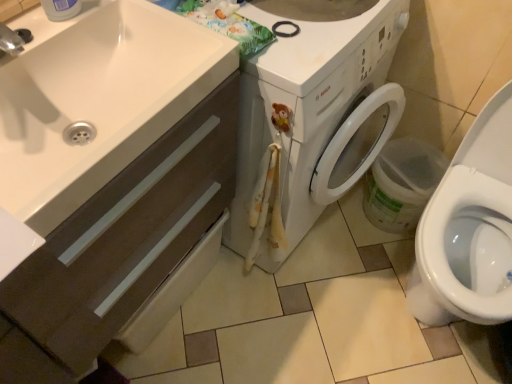
Locate an element on the screen. matte brown cabinet at lower left is located at coordinates 127,236.

What do you see at coordinates (127, 236) in the screenshot? The width and height of the screenshot is (512, 384). I see `matte brown cabinet at lower left` at bounding box center [127, 236].

Locate an element on the screen. The width and height of the screenshot is (512, 384). white glossy toilet at lower right is located at coordinates (469, 228).

Describe the element at coordinates (469, 228) in the screenshot. I see `white glossy toilet at lower right` at that location.

What do you see at coordinates (316, 104) in the screenshot?
I see `white glossy washing machine at center` at bounding box center [316, 104].

Locate an element on the screen. The width and height of the screenshot is (512, 384). matte brown cabinet at lower left is located at coordinates (127, 236).

Is white glossy toilet at lower right facing away from white glossy washing machine at center?

No.

Would you say white glossy toilet at lower right is a long distance from white glossy washing machine at center?

No, white glossy toilet at lower right is not far from white glossy washing machine at center.

Does white glossy toilet at lower right have a larger size compared to white glossy washing machine at center?

Actually, white glossy toilet at lower right might be smaller than white glossy washing machine at center.

How many degrees apart are the facing directions of white glossy toilet at lower right and white glossy washing machine at center?

90 degrees.

What's the angular difference between white glossy washing machine at center and matte brown cabinet at lower left's facing directions?

0.000337 degrees.

Between white glossy washing machine at center and matte brown cabinet at lower left, which one appears on the left side from the viewer's perspective?

matte brown cabinet at lower left is more to the left.

Is white glossy washing machine at center taller than matte brown cabinet at lower left?

A: No, white glossy washing machine at center is not taller than matte brown cabinet at lower left.

Is white glossy washing machine at center with matte brown cabinet at lower left?

No, white glossy washing machine at center is not next to matte brown cabinet at lower left.

Is white glossy sink at lower left positioned with its back to matte brown cabinet at lower left?

Yes, white glossy sink at lower left is facing away from matte brown cabinet at lower left.

Considering the points (168, 27) and (116, 210), which point is in front, point (168, 27) or point (116, 210)?

Positioned in front is point (116, 210).

In the scene shown: Is white glossy sink at lower left bigger or smaller than matte brown cabinet at lower left?

Considering their sizes, white glossy sink at lower left takes up less space than matte brown cabinet at lower left.

Looking at their sizes, would you say white glossy sink at lower left is wider or thinner than white glossy washing machine at center?

In the image, white glossy sink at lower left appears to be more narrow than white glossy washing machine at center.

Is white glossy sink at lower left next to white glossy washing machine at center?

No, white glossy sink at lower left is not touching white glossy washing machine at center.

From the image's perspective, is white glossy sink at lower left located above or below white glossy washing machine at center?

Based on their image positions, white glossy sink at lower left is located beneath white glossy washing machine at center.

You are a GUI agent. You are given a task and a screenshot of the screen. Output one action in this format:
    pyautogui.click(x=<x>, y=<y>)
    Task: Click on the toilet located in front of the white glossy washing machine at center
    
    Given the screenshot: What is the action you would take?
    pyautogui.click(x=469, y=228)

Can you tell me how much white glossy washing machine at center and white glossy toilet at lower right differ in facing direction?

90 degrees separate the facing orientations of white glossy washing machine at center and white glossy toilet at lower right.

Can we say white glossy washing machine at center lies outside white glossy toilet at lower right?

white glossy washing machine at center is positioned outside white glossy toilet at lower right.

You are a GUI agent. You are given a task and a screenshot of the screen. Output one action in this format:
    pyautogui.click(x=<x>, y=<y>)
    Task: Click on the bathroom cabinet lying below the white glossy toilet at lower right (from the image's perspective)
    This screenshot has width=512, height=384.
    Given the screenshot: What is the action you would take?
    pyautogui.click(x=127, y=236)

Considering the sizes of white glossy toilet at lower right and matte brown cabinet at lower left in the image, is white glossy toilet at lower right bigger or smaller than matte brown cabinet at lower left?

white glossy toilet at lower right is smaller than matte brown cabinet at lower left.

From the image's perspective, would you say white glossy toilet at lower right is positioned over matte brown cabinet at lower left?

Yes, from the image's perspective, white glossy toilet at lower right is on top of matte brown cabinet at lower left.

From the image's perspective, is matte brown cabinet at lower left over white glossy washing machine at center?

No, from the image's perspective, matte brown cabinet at lower left is not on top of white glossy washing machine at center.

Is matte brown cabinet at lower left oriented away from white glossy washing machine at center?

No, matte brown cabinet at lower left is not facing the opposite direction of white glossy washing machine at center.

Is the depth of matte brown cabinet at lower left less than that of white glossy washing machine at center?

That is True.

From a real-world perspective, who is located lower, matte brown cabinet at lower left or white glossy washing machine at center?

white glossy washing machine at center is physically lower.

Find the location of a particular element. washing machine above the white glossy toilet at lower right (from a real-world perspective) is located at coordinates (316, 104).

Find the location of `washing machine below the matte brown cabinet at lower left (from a real-world perspective)`. washing machine below the matte brown cabinet at lower left (from a real-world perspective) is located at coordinates (316, 104).

When comparing their distances from white glossy toilet at lower right, does white glossy washing machine at center or white glossy sink at lower left seem closer?

white glossy washing machine at center is positioned closer to the anchor white glossy toilet at lower right.

Which object lies further to the anchor point matte brown cabinet at lower left, white glossy toilet at lower right or white glossy sink at lower left?

Among the two, white glossy toilet at lower right is located further to matte brown cabinet at lower left.

Based on their spatial positions, is white glossy washing machine at center or matte brown cabinet at lower left further from white glossy sink at lower left?

Based on the image, white glossy washing machine at center appears to be further to white glossy sink at lower left.

When comparing their distances from matte brown cabinet at lower left, does white glossy washing machine at center or white glossy toilet at lower right seem closer?

white glossy washing machine at center is closer to matte brown cabinet at lower left.

From the image, which object appears to be nearer to matte brown cabinet at lower left, white glossy toilet at lower right or white glossy washing machine at center?

The object closer to matte brown cabinet at lower left is white glossy washing machine at center.

Based on their spatial positions, is matte brown cabinet at lower left or white glossy sink at lower left closer to white glossy washing machine at center?

matte brown cabinet at lower left lies closer to white glossy washing machine at center than the other object.

Which object lies nearer to the anchor point white glossy sink at lower left, white glossy washing machine at center or white glossy toilet at lower right?

white glossy washing machine at center lies closer to white glossy sink at lower left than the other object.

In the scene shown: Which object lies nearer to the anchor point white glossy washing machine at center, white glossy sink at lower left or white glossy toilet at lower right?

white glossy sink at lower left is closer to white glossy washing machine at center.

You are a GUI agent. You are given a task and a screenshot of the screen. Output one action in this format:
    pyautogui.click(x=<x>, y=<y>)
    Task: Click on the washing machine between white glossy sink at lower left and white glossy toilet at lower right in the horizontal direction
    The image size is (512, 384).
    Given the screenshot: What is the action you would take?
    pyautogui.click(x=316, y=104)

Identify the location of sink located between matte brown cabinet at lower left and white glossy toilet at lower right in the left-right direction. Image resolution: width=512 pixels, height=384 pixels. (97, 100).

At what (x,y) coordinates should I click in order to perform the action: click on sink between matte brown cabinet at lower left and white glossy washing machine at center from left to right. Please return your answer as a coordinate pair (x, y). Image resolution: width=512 pixels, height=384 pixels. Looking at the image, I should click on (97, 100).

Identify the location of washing machine between matte brown cabinet at lower left and white glossy toilet at lower right in the horizontal direction. This screenshot has height=384, width=512. (316, 104).